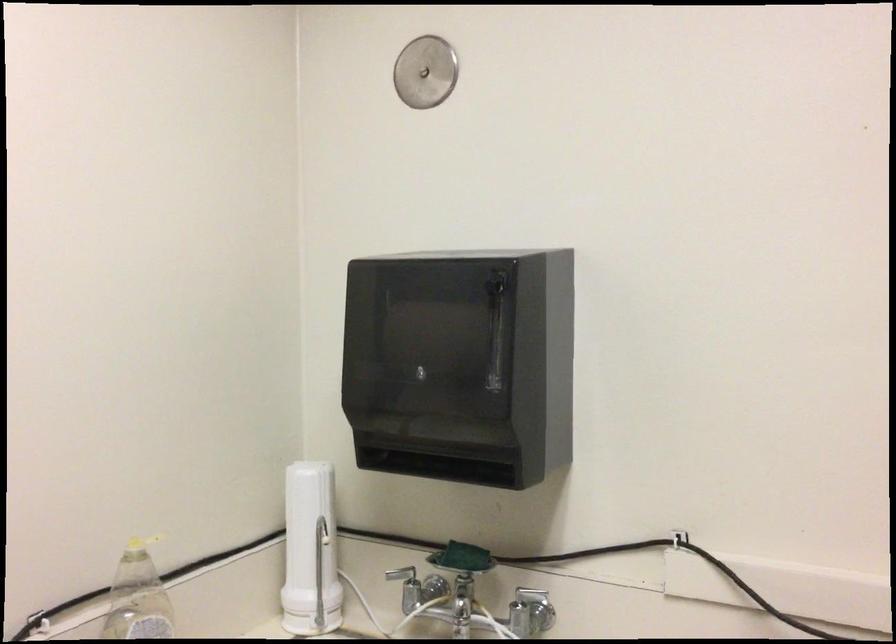
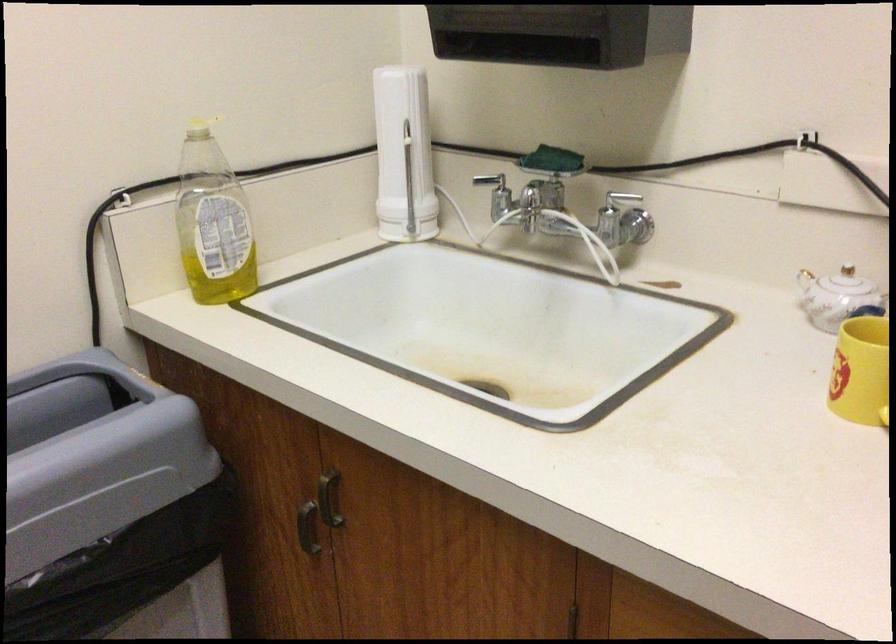
Find the pixel in the second image that matches (x=119, y=541) in the first image.

(200, 128)